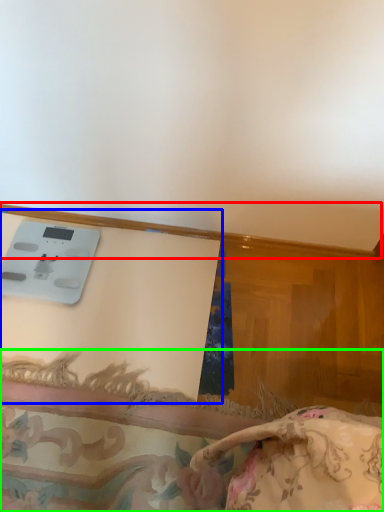
Question: Which is nearer to the trim (highlighted by a red box)? table (highlighted by a blue box) or furniture (highlighted by a green box).

Choices:
 (A) table
 (B) furniture

Answer: (A)